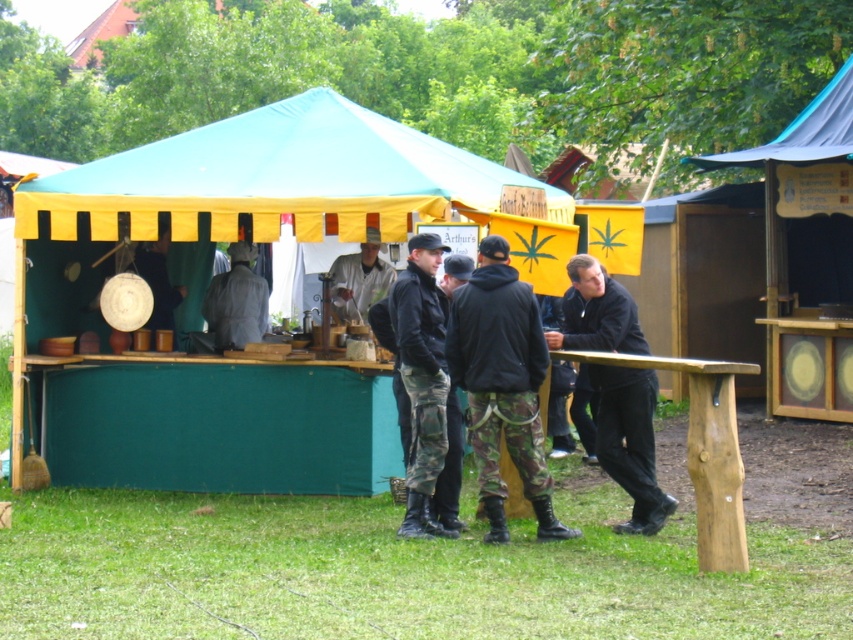
You are a costume designer preparing for a play and need to know the spatial arrangement of the two clothing items in the scene. Are the camo pants at center positioned to the left or right of the black matte jacket at center?

The camo pants at center is to the left of black matte jacket at center according to the description.

You are a visitor at the medieval fair and want to know if you can comfortably stand between the teal fabric tent at center and the black matte jacket at center without feeling cramped. The average person requires 0.7 meters of space to stand comfortably. Can you fit between them?

The teal fabric tent at center is 1.85 meters from the black matte jacket at center. Since the required space for comfort is 0.7 meters, the distance between them is more than enough for you to stand comfortably between the teal fabric tent at center and the black matte jacket at center.

You are a vendor at the medieval fair and need to reach your tent, which is behind the table. The path to the tent is narrow and only allows passage if the distance between the camo pants at center and light gray fabric jacket at center is at least 4 meters. Can you safely walk through the path?

The distance between the camo pants at center and light gray fabric jacket at center is 3.77 meters, which is less than the required 4 meters. Therefore, you cannot safely walk through the path.